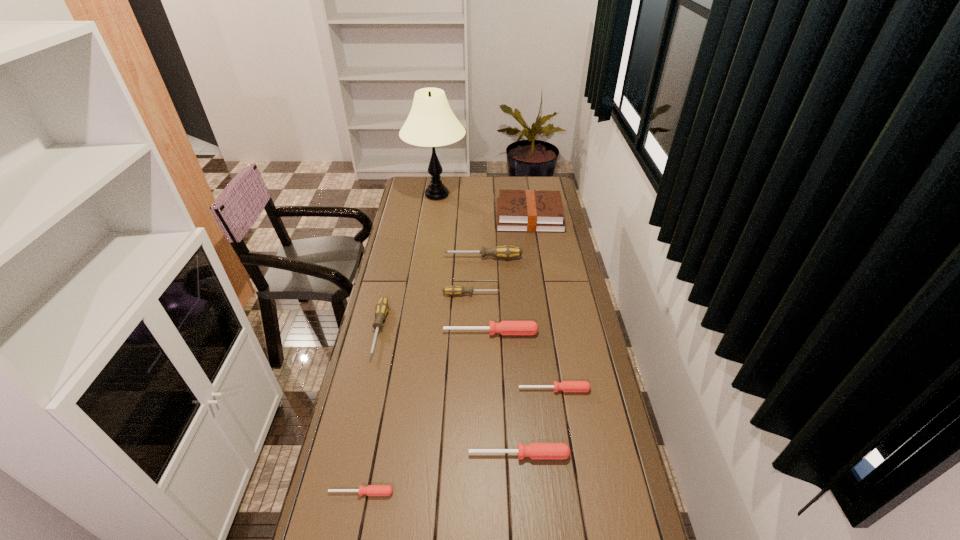
Locate an element on the screen. blank region between the third tallest object and the eighth farthest object is located at coordinates (501, 356).

This screenshot has height=540, width=960. Identify the location of vacant space in between the second nearest screwdriver and the nearest red screwdriver. (441, 474).

The height and width of the screenshot is (540, 960). I want to click on vacant space that's between the third nearest object and the farthest red screwdriver, so [522, 361].

Point out which object is positioned as the second nearest to the hardback book. Please provide its 2D coordinates. Your answer should be formatted as a tuple, i.e. [(x, y)], where the tuple contains the x and y coordinates of a point satisfying the conditions above.

[(507, 251)]

Identify which object is the third nearest to the lamp. Please provide its 2D coordinates. Your answer should be formatted as a tuple, i.e. [(x, y)], where the tuple contains the x and y coordinates of a point satisfying the conditions above.

[(453, 290)]

Identify which screwdriver is located as the second nearest to the sixth nearest object. Please provide its 2D coordinates. Your answer should be formatted as a tuple, i.e. [(x, y)], where the tuple contains the x and y coordinates of a point satisfying the conditions above.

[(507, 251)]

I want to click on screwdriver that stands as the fourth closest to the farthest gray screwdriver, so click(566, 386).

Locate which gray screwdriver ranks third in proximity to the hardback book. Please provide its 2D coordinates. Your answer should be formatted as a tuple, i.e. [(x, y)], where the tuple contains the x and y coordinates of a point satisfying the conditions above.

[(382, 307)]

Image resolution: width=960 pixels, height=540 pixels. Find the location of `the second closest gray screwdriver relative to the second nearest screwdriver`. the second closest gray screwdriver relative to the second nearest screwdriver is located at coordinates click(453, 290).

I want to click on the closest red screwdriver to the second farthest screwdriver, so click(504, 327).